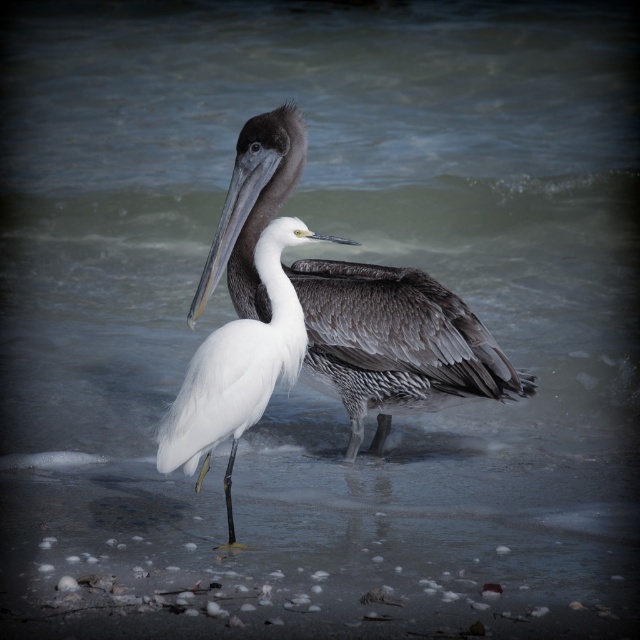
You are a birdwatcher observing the two birds on the beach. Which bird, the brown feathered pelican at center or the white feathered bird at center, is taller?

The brown feathered pelican at center is taller than the white feathered bird at center.

You are a wildlife photographer aiming to capture both the brown feathered pelican at center and the white feathered bird at center in a single frame. Given their sizes, which bird will occupy more space in your photo?

The brown feathered pelican at center is wider than the white feathered bird at center, so it will occupy more space in the photo.

Looking at this image, you are standing on the beach and see two points marked on the ground. One is at point (248, 305) and the other is at point (188, 451). Which point is closer to you?

Point (188, 451) is closer to you because it is nearer to the camera compared to point (248, 305).